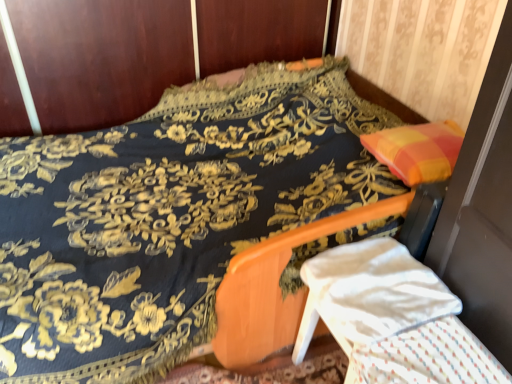
What do you see at coordinates (397, 316) in the screenshot?
I see `white fabric armchair at lower right` at bounding box center [397, 316].

Locate an element on the screen. white fabric armchair at lower right is located at coordinates (397, 316).

This screenshot has height=384, width=512. Describe the element at coordinates (428, 357) in the screenshot. I see `white textured blanket at lower right` at that location.

Image resolution: width=512 pixels, height=384 pixels. I want to click on white textured blanket at lower right, so click(428, 357).

The height and width of the screenshot is (384, 512). In order to click on white fabric armchair at lower right in this screenshot , I will do `click(397, 316)`.

Can you confirm if white textured blanket at lower right is positioned to the left of white fabric armchair at lower right?

No, white textured blanket at lower right is not to the left of white fabric armchair at lower right.

Is the depth of white textured blanket at lower right less than that of white fabric armchair at lower right?

Yes, white textured blanket at lower right is closer to the viewer.

Considering the points (392, 381) and (411, 260), which point is behind, point (392, 381) or point (411, 260)?

The point (411, 260) is behind.

From the image's perspective, would you say white textured blanket at lower right is positioned over white fabric armchair at lower right?

Incorrect, from the image's perspective, white textured blanket at lower right is lower than white fabric armchair at lower right.

Looking at this image, from a real-world perspective, between white textured blanket at lower right and white fabric armchair at lower right, who is vertically lower?

white fabric armchair at lower right, from a real-world perspective.

Can you confirm if white textured blanket at lower right is thinner than white fabric armchair at lower right?

No, white textured blanket at lower right is not thinner than white fabric armchair at lower right.

Which of these two, white textured blanket at lower right or white fabric armchair at lower right, stands shorter?

With less height is white textured blanket at lower right.

Considering the sizes of objects white textured blanket at lower right and white fabric armchair at lower right in the image provided, who is bigger, white textured blanket at lower right or white fabric armchair at lower right?

Bigger between the two is white fabric armchair at lower right.

Can white fabric armchair at lower right be found inside white textured blanket at lower right?

No, white textured blanket at lower right does not contain white fabric armchair at lower right.

In the scene shown: Is white textured blanket at lower right placed right next to white fabric armchair at lower right?

Absolutely, white textured blanket at lower right is next to and touching white fabric armchair at lower right.

Could you tell me if white textured blanket at lower right is facing white fabric armchair at lower right?

No, white textured blanket at lower right does not turn towards white fabric armchair at lower right.

The height and width of the screenshot is (384, 512). Identify the location of armchair on the left of white textured blanket at lower right. (397, 316).

Does white fabric armchair at lower right appear on the right side of white textured blanket at lower right?

No.

Between white fabric armchair at lower right and white textured blanket at lower right, which one is positioned behind?

white fabric armchair at lower right is further away from the camera.

Between point (461, 338) and point (408, 343), which one is positioned behind?

The point (461, 338) is behind.

From the image's perspective, would you say white fabric armchair at lower right is shown under white textured blanket at lower right?

No, from the image's perspective, white fabric armchair at lower right is not beneath white textured blanket at lower right.

Based on the photo, from a real-world perspective, who is located lower, white fabric armchair at lower right or white textured blanket at lower right?

white fabric armchair at lower right is physically lower.

Consider the image. Does white fabric armchair at lower right have a lesser width compared to white textured blanket at lower right?

Indeed, white fabric armchair at lower right has a lesser width compared to white textured blanket at lower right.

Can you confirm if white fabric armchair at lower right is taller than white textured blanket at lower right?

Indeed, white fabric armchair at lower right has a greater height compared to white textured blanket at lower right.

Considering the sizes of objects white fabric armchair at lower right and white textured blanket at lower right in the image provided, who is smaller, white fabric armchair at lower right or white textured blanket at lower right?

white textured blanket at lower right is smaller.

Can we say white fabric armchair at lower right lies outside white textured blanket at lower right?

Yes.

Is white fabric armchair at lower right not near white textured blanket at lower right?

No.

Is white fabric armchair at lower right looking in the opposite direction of white textured blanket at lower right?

white fabric armchair at lower right does not have its back to white textured blanket at lower right.

How different are the orientations of white fabric armchair at lower right and white textured blanket at lower right in degrees?

The angle between the facing direction of white fabric armchair at lower right and the facing direction of white textured blanket at lower right is 0.333 degrees.

The image size is (512, 384). I want to click on blanket on the right of white fabric armchair at lower right, so click(428, 357).

Locate an element on the screen. This screenshot has width=512, height=384. armchair to the left of white textured blanket at lower right is located at coordinates (397, 316).

Find the location of `armchair behind the white textured blanket at lower right`. armchair behind the white textured blanket at lower right is located at coordinates (397, 316).